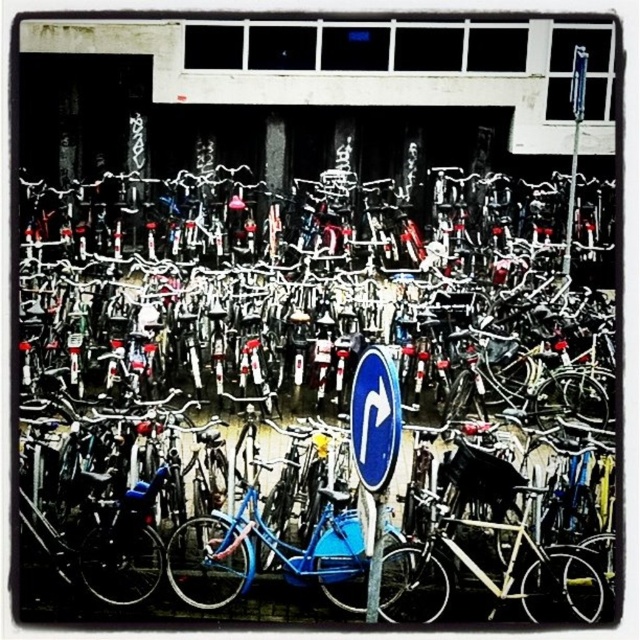
You are a delivery person who needs to load a box onto the blue matte bicycle at center. The box is 1.2 meters tall. Can the box fit vertically without hitting the blue plastic street sign at center?

The blue matte bicycle at center is much taller than the blue plastic street sign at center, so the box may not fit vertically as the bicycle itself is taller than the sign.

Consider the image. You are a delivery person trying to navigate through the bicycle parking area. You need to move your package from the blue plastic street sign at center to the blue matte bicycle at center. Which direction should you move the package to reach the bicycle?

The blue matte bicycle at center is above the blue plastic street sign at center, so you should move the package upward to reach the bicycle.